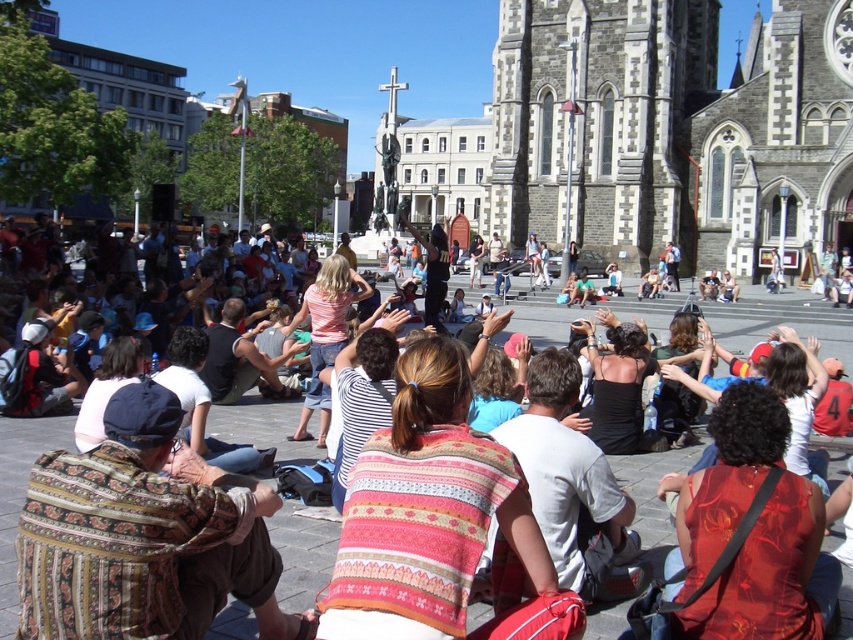
Question: Which of the following is the closest to the observer?

Choices:
 (A) striped fabric shirt at center
 (B) black satin dress at center
 (C) floral silk dress at center

Answer: (A)

Question: Does floral silk dress at center appear under black satin dress at center?

Choices:
 (A) yes
 (B) no

Answer: (A)

Question: Does floral silk dress at center have a greater width compared to black satin dress at center?

Choices:
 (A) no
 (B) yes

Answer: (B)

Question: Among these objects, which one is nearest to the camera?

Choices:
 (A) patterned fabric shirt at lower left
 (B) black satin dress at center

Answer: (A)

Question: Where is patterned fabric shirt at lower left located in relation to floral silk dress at center in the image?

Choices:
 (A) above
 (B) below

Answer: (B)

Question: Which of the following is the farthest from the observer?

Choices:
 (A) (759, 627)
 (B) (393, 611)

Answer: (B)